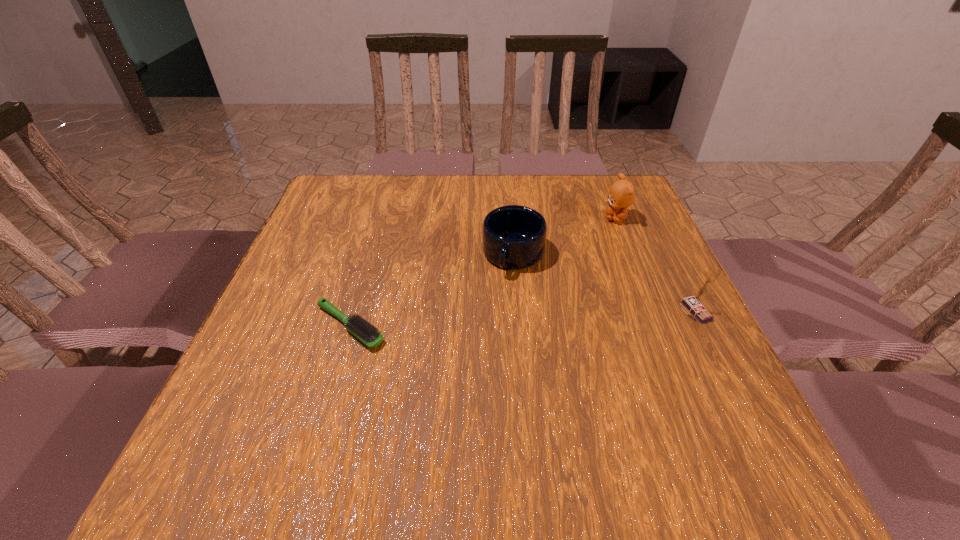
You are a GUI agent. You are given a task and a screenshot of the screen. Output one action in this format:
    pyautogui.click(x=<x>, y=<y>)
    Task: Click on the leftmost object
    
    Given the screenshot: What is the action you would take?
    pyautogui.click(x=368, y=334)

Where is `the shortest object`? This screenshot has width=960, height=540. the shortest object is located at coordinates click(x=368, y=334).

Identify the location of matchbox. Image resolution: width=960 pixels, height=540 pixels. (694, 303).

Identify the location of the second farthest object. Image resolution: width=960 pixels, height=540 pixels. (513, 237).

At what (x,y) coordinates should I click in order to perform the action: click on the second object from left to right. Please return your answer as a coordinate pair (x, y). The width and height of the screenshot is (960, 540). Looking at the image, I should click on pyautogui.click(x=513, y=237).

Where is `the third object from left to right`? The image size is (960, 540). the third object from left to right is located at coordinates (622, 193).

The width and height of the screenshot is (960, 540). I want to click on teddy bear, so click(x=622, y=193).

Where is `vacant space located 0.250m on the right of the shortest object`? vacant space located 0.250m on the right of the shortest object is located at coordinates click(511, 326).

Where is `free space located 0.160m on the left of the matchbox`? free space located 0.160m on the left of the matchbox is located at coordinates (606, 311).

Locate an element on the screen. free space located 0.190m with the handle on the side of the second shortest object is located at coordinates (478, 339).